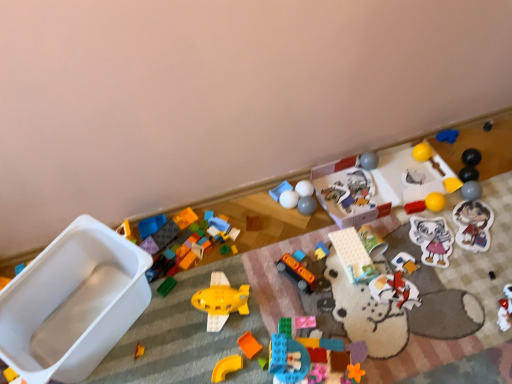
Where is `free location to the right of yellow matte square at center-right, placed as the 22th toy when sorted from left to right`? This screenshot has height=384, width=512. free location to the right of yellow matte square at center-right, placed as the 22th toy when sorted from left to right is located at coordinates (493, 196).